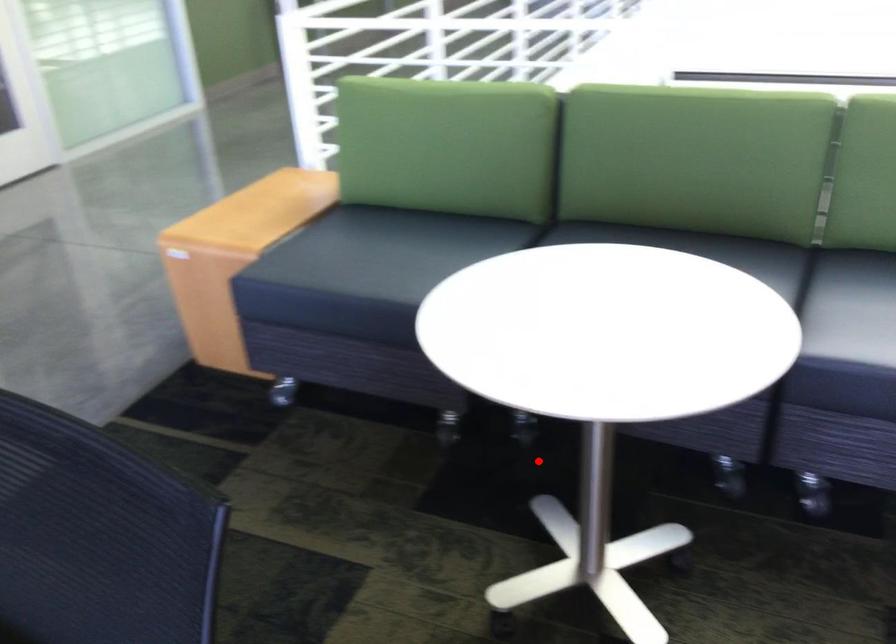
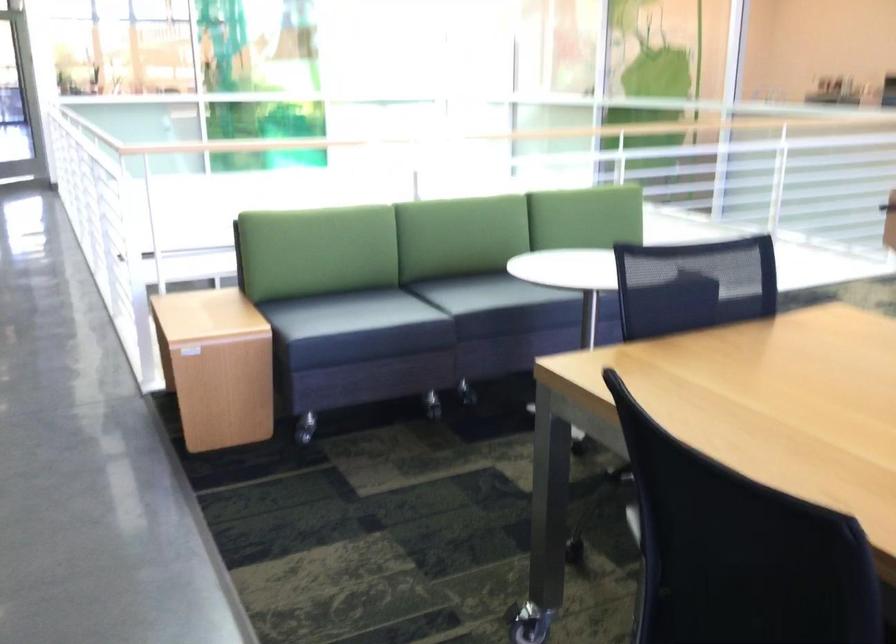
Find the pixel in the second image that matches the highlighted location in the first image.

(432, 404)